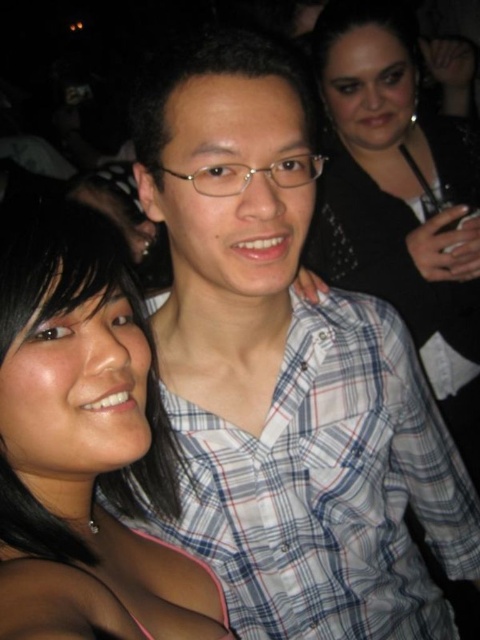
Question: From the image, what is the correct spatial relationship of black matte hair at center in relation to black sequined dress at upper right?

Choices:
 (A) left
 (B) right

Answer: (A)

Question: Which of these objects is positioned farthest from the white checkered shirt at center?

Choices:
 (A) black sequined dress at upper right
 (B) black matte hair at center

Answer: (A)

Question: Is white checkered shirt at center below black sequined dress at upper right?

Choices:
 (A) no
 (B) yes

Answer: (B)

Question: Does white checkered shirt at center have a greater width compared to black sequined dress at upper right?

Choices:
 (A) yes
 (B) no

Answer: (A)

Question: Which object is positioned farthest from the black matte hair at center?

Choices:
 (A) black sequined dress at upper right
 (B) white checkered shirt at center

Answer: (A)

Question: Estimate the real-world distances between objects in this image. Which object is closer to the white checkered shirt at center?

Choices:
 (A) black sequined dress at upper right
 (B) black matte hair at center

Answer: (B)